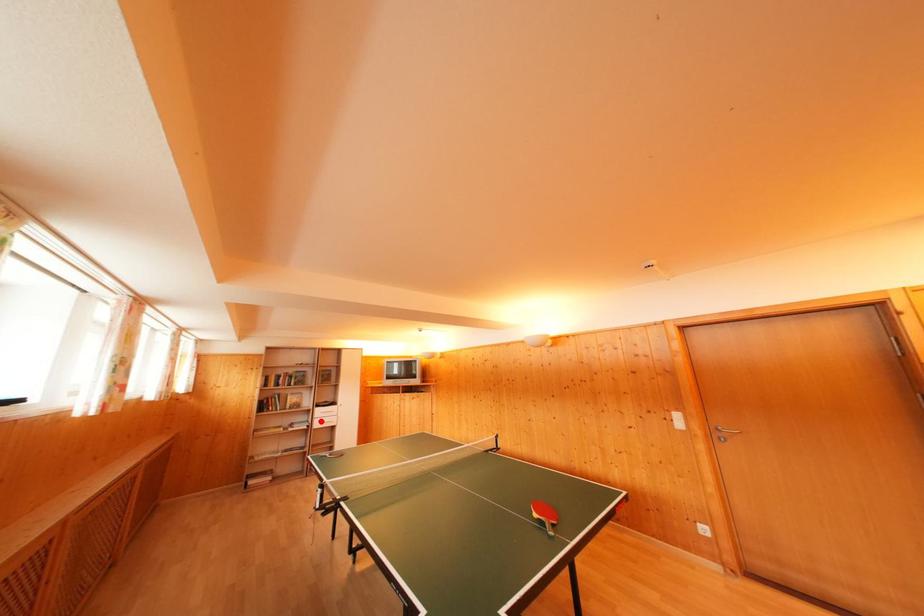
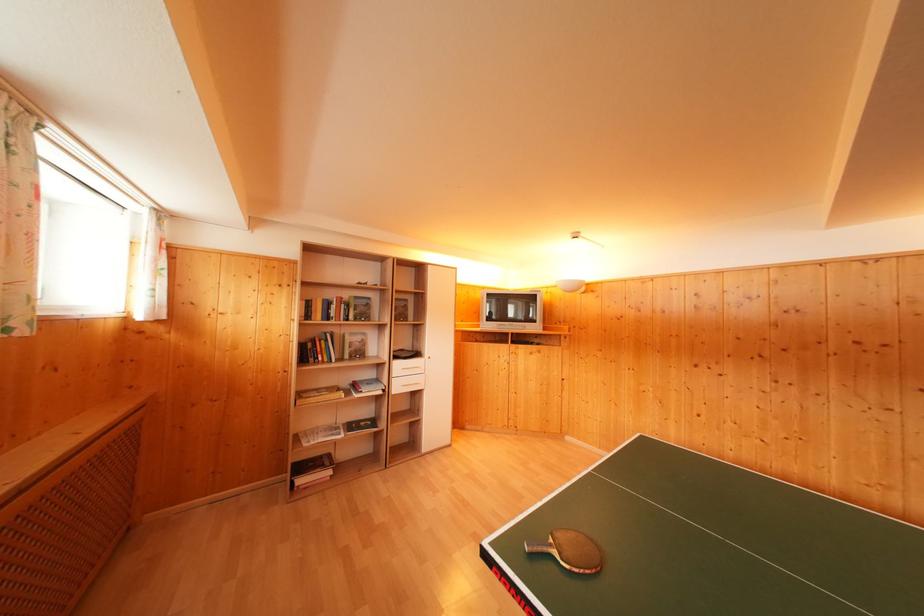
Locate, in the second image, the point that corresponds to the highlighted location in the first image.

(398, 379)